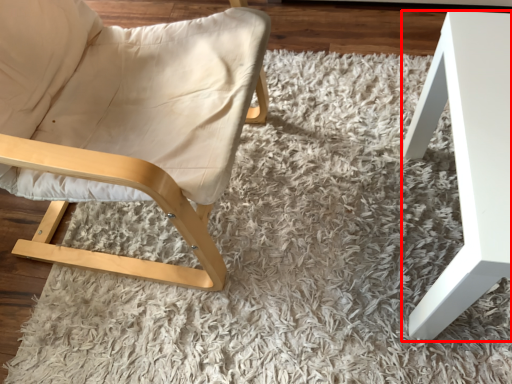
Question: In this image, where is table (annotated by the red box) located relative to chair?

Choices:
 (A) right
 (B) left

Answer: (A)